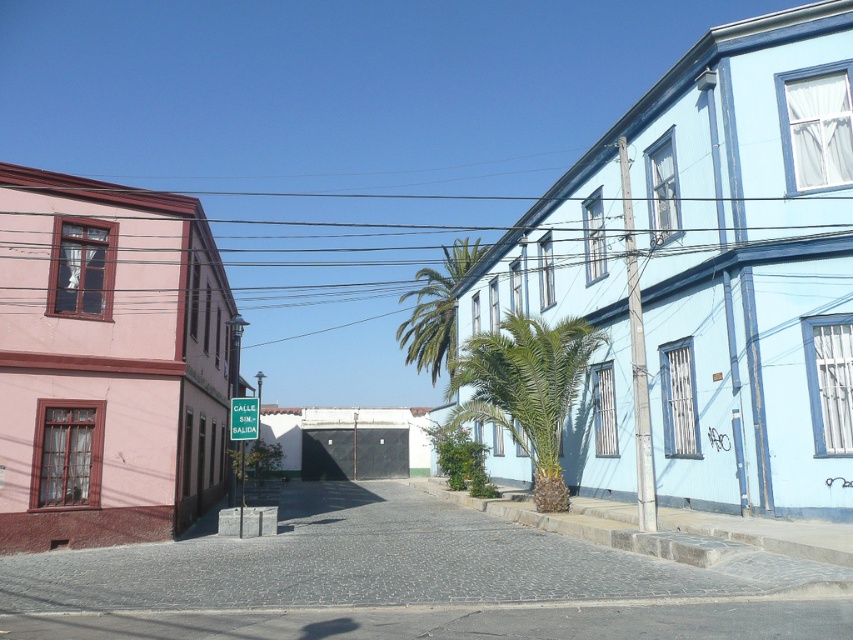
Question: Does green leafy palm at center have a smaller size compared to green leafy palm tree at center?

Choices:
 (A) no
 (B) yes

Answer: (B)

Question: Which point is closer to the camera taking this photo?

Choices:
 (A) (466, 262)
 (B) (254, 426)
 (C) (518, 339)

Answer: (B)

Question: Among these points, which one is farthest from the camera?

Choices:
 (A) (453, 241)
 (B) (233, 428)

Answer: (A)

Question: Where is green leafy palm tree at center located in relation to green plastic sign at center in the image?

Choices:
 (A) left
 (B) right

Answer: (B)

Question: Can you confirm if green leafy palm at center is bigger than green plastic sign at center?

Choices:
 (A) no
 (B) yes

Answer: (A)

Question: Which of these objects is positioned farthest from the green leafy palm tree at center?

Choices:
 (A) green leafy palm at center
 (B) green plastic sign at center

Answer: (A)